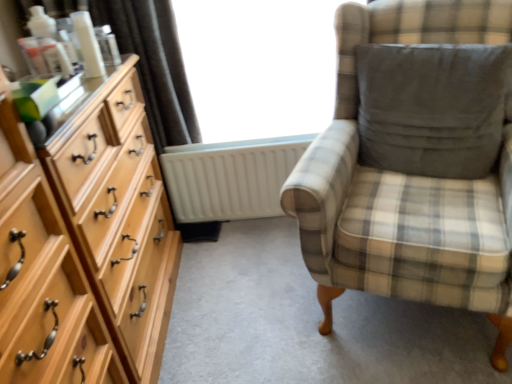
Question: Are plaid fabric chair at right and satin dark brown curtain at upper left making contact?

Choices:
 (A) yes
 (B) no

Answer: (B)

Question: Considering the relative sizes of plaid fabric chair at right and satin dark brown curtain at upper left in the image provided, is plaid fabric chair at right smaller than satin dark brown curtain at upper left?

Choices:
 (A) no
 (B) yes

Answer: (A)

Question: From the image's perspective, would you say plaid fabric chair at right is positioned over satin dark brown curtain at upper left?

Choices:
 (A) yes
 (B) no

Answer: (B)

Question: Can you confirm if plaid fabric chair at right is wider than satin dark brown curtain at upper left?

Choices:
 (A) no
 (B) yes

Answer: (B)

Question: Can you confirm if plaid fabric chair at right is bigger than satin dark brown curtain at upper left?

Choices:
 (A) yes
 (B) no

Answer: (A)

Question: Is point (119, 249) positioned closer to the camera than point (159, 54)?

Choices:
 (A) farther
 (B) closer

Answer: (B)

Question: Is light wood dresser at left bigger or smaller than satin dark brown curtain at upper left?

Choices:
 (A) small
 (B) big

Answer: (B)

Question: From the image's perspective, relative to satin dark brown curtain at upper left, is light wood dresser at left above or below?

Choices:
 (A) above
 (B) below

Answer: (B)

Question: Based on their positions, is light wood dresser at left located to the left or right of satin dark brown curtain at upper left?

Choices:
 (A) right
 (B) left

Answer: (A)

Question: In terms of height, does transparent glass window at center look taller or shorter compared to dark gray fabric pillow at right?

Choices:
 (A) tall
 (B) short

Answer: (A)

Question: Is transparent glass window at center wider or thinner than dark gray fabric pillow at right?

Choices:
 (A) thin
 (B) wide

Answer: (A)

Question: Is transparent glass window at center to the left or to the right of dark gray fabric pillow at right in the image?

Choices:
 (A) left
 (B) right

Answer: (A)

Question: Looking at the image, does transparent glass window at center seem bigger or smaller compared to dark gray fabric pillow at right?

Choices:
 (A) big
 (B) small

Answer: (A)

Question: Considering the positions of transparent glass window at center and satin dark brown curtain at upper left in the image, is transparent glass window at center bigger or smaller than satin dark brown curtain at upper left?

Choices:
 (A) big
 (B) small

Answer: (A)

Question: From the image's perspective, is transparent glass window at center above or below satin dark brown curtain at upper left?

Choices:
 (A) above
 (B) below

Answer: (A)